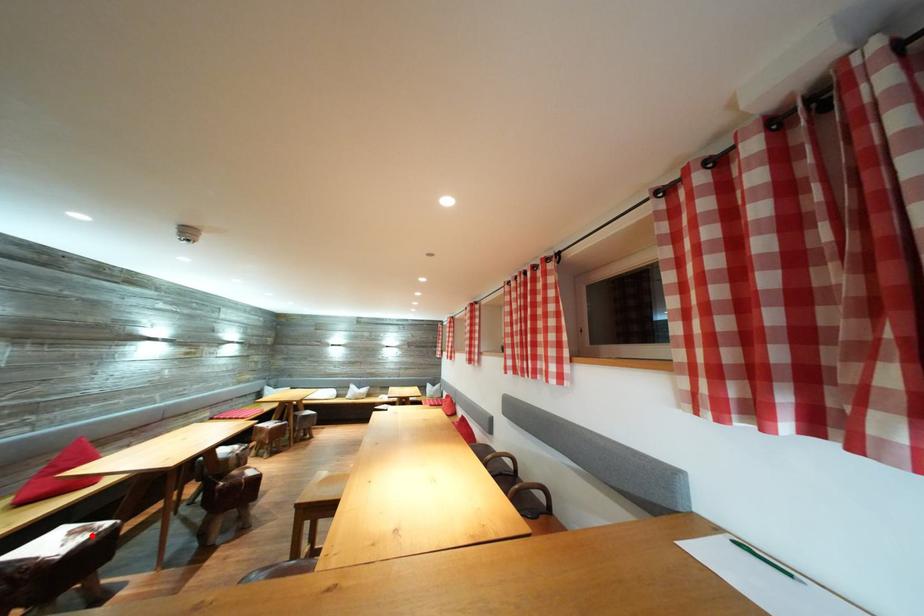
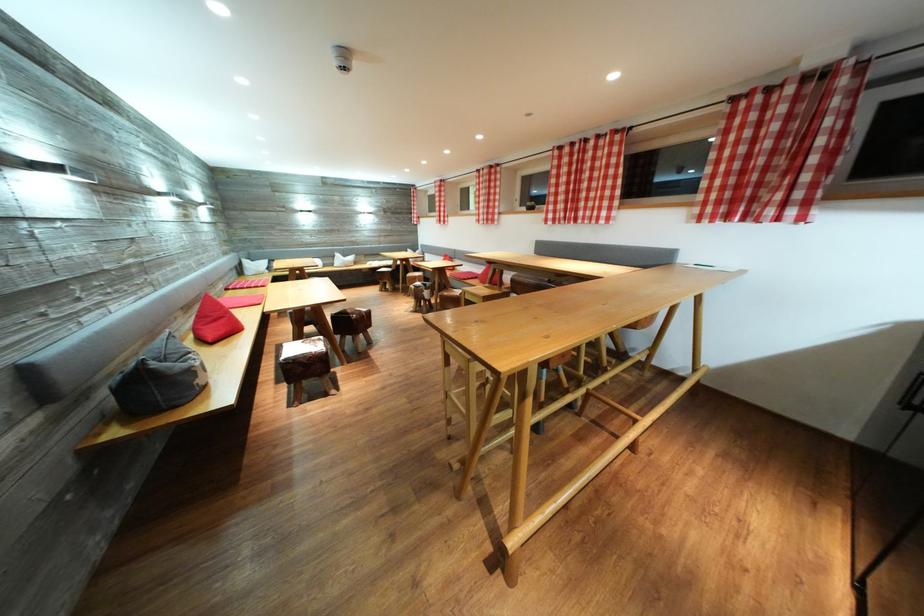
Where in the second image is the point corresponding to the highlighted location from the first image?

(321, 346)